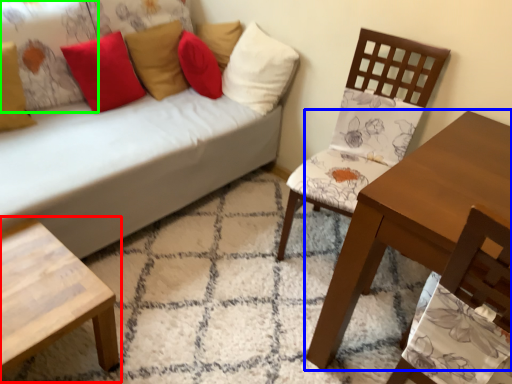
Question: Which object is the closest to the coffee table (highlighted by a red box)? Choose among these: table (highlighted by a blue box) or pillow (highlighted by a green box).

Choices:
 (A) table
 (B) pillow

Answer: (A)